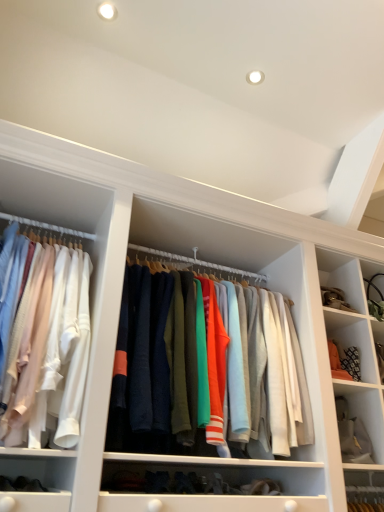
What do you see at coordinates (264, 368) in the screenshot? This screenshot has width=384, height=512. I see `knit sweater at center, placed as the second clothing when sorted from left to right` at bounding box center [264, 368].

What do you see at coordinates (49, 342) in the screenshot? I see `matte white shirts at left, acting as the first clothing starting from the left` at bounding box center [49, 342].

This screenshot has height=512, width=384. What do you see at coordinates (366, 412) in the screenshot?
I see `white fabric at lower right` at bounding box center [366, 412].

Where is `knit sweater at center, which is the 1th clothing from right to left`? knit sweater at center, which is the 1th clothing from right to left is located at coordinates (264, 368).

Is matte white shirts at left, acting as the first clothing starting from the left, to the right of white fabric at lower right from the viewer's perspective?

No.

Between matte white shirts at left, which is counted as the second clothing, starting from the right, and white fabric at lower right, which one is positioned behind?

white fabric at lower right.

From the image's perspective, which is above, matte white shirts at left, acting as the first clothing starting from the left, or white fabric at lower right?

matte white shirts at left, acting as the first clothing starting from the left, is shown above in the image.

Considering the relative sizes of knit sweater at center, placed as the second clothing when sorted from left to right, and white fabric at lower right in the image provided, is knit sweater at center, placed as the second clothing when sorted from left to right, wider than white fabric at lower right?

Yes, knit sweater at center, placed as the second clothing when sorted from left to right, is wider than white fabric at lower right.

Are knit sweater at center, which is the 1th clothing from right to left, and white fabric at lower right located far from each other?

That's not correct — knit sweater at center, which is the 1th clothing from right to left, is a little close to white fabric at lower right.

Based on the photo, what's the angular difference between knit sweater at center, which is the 1th clothing from right to left, and white fabric at lower right's facing directions?

They differ by 1.25 degrees in their facing directions.

Can you confirm if knit sweater at center, which is the 1th clothing from right to left, is taller than white fabric at lower right?

Correct, knit sweater at center, which is the 1th clothing from right to left, is much taller as white fabric at lower right.

Which of these two, knit sweater at center, which is the 1th clothing from right to left, or matte white shirts at left, acting as the first clothing starting from the left, is wider?

knit sweater at center, which is the 1th clothing from right to left, is wider.

Does knit sweater at center, which is the 1th clothing from right to left, have a smaller size compared to matte white shirts at left, which is counted as the second clothing, starting from the right?

No, knit sweater at center, which is the 1th clothing from right to left, is not smaller than matte white shirts at left, which is counted as the second clothing, starting from the right.

Is point (183, 329) closer or farther from the camera than point (75, 250)?

Point (183, 329) appears to be closer to the viewer than point (75, 250).

Considering the positions of objects knit sweater at center, which is the 1th clothing from right to left, and matte white shirts at left, acting as the first clothing starting from the left, in the image provided, who is more to the right, knit sweater at center, which is the 1th clothing from right to left, or matte white shirts at left, acting as the first clothing starting from the left,?

From the viewer's perspective, knit sweater at center, which is the 1th clothing from right to left, appears more on the right side.

Can you confirm if white fabric at lower right is positioned to the left of matte white shirts at left, which is counted as the second clothing, starting from the right?

No, white fabric at lower right is not to the left of matte white shirts at left, which is counted as the second clothing, starting from the right.

From a real-world perspective, is white fabric at lower right located beneath matte white shirts at left, acting as the first clothing starting from the left?

Yes.

Can you confirm if white fabric at lower right is taller than matte white shirts at left, acting as the first clothing starting from the left?

Incorrect, the height of white fabric at lower right is not larger of that of matte white shirts at left, acting as the first clothing starting from the left.

The width and height of the screenshot is (384, 512). I want to click on cabinet below the matte white shirts at left, acting as the first clothing starting from the left (from the image's perspective), so click(x=366, y=412).

Is point (89, 273) closer to viewer compared to point (295, 383)?

Yes, point (89, 273) is closer to viewer.

Is matte white shirts at left, which is counted as the second clothing, starting from the right, far from knit sweater at center, which is the 1th clothing from right to left?

No.

Does matte white shirts at left, acting as the first clothing starting from the left, have a greater width compared to knit sweater at center, placed as the second clothing when sorted from left to right?

No.

Can you see white fabric at lower right touching knit sweater at center, which is the 1th clothing from right to left?

No, white fabric at lower right is not making contact with knit sweater at center, which is the 1th clothing from right to left.

In the image, is white fabric at lower right positioned in front of or behind knit sweater at center, placed as the second clothing when sorted from left to right?

white fabric at lower right is positioned farther from the viewer than knit sweater at center, placed as the second clothing when sorted from left to right.

Does point (381, 404) appear closer or farther from the camera than point (267, 347)?

Point (381, 404) is farther from the camera than point (267, 347).

Is white fabric at lower right wider or thinner than knit sweater at center, which is the 1th clothing from right to left?

Considering their sizes, white fabric at lower right looks slimmer than knit sweater at center, which is the 1th clothing from right to left.

Find the location of a particular element. The image size is (384, 512). cabinet below the matte white shirts at left, which is counted as the second clothing, starting from the right (from a real-world perspective) is located at coordinates tap(366, 412).

Image resolution: width=384 pixels, height=512 pixels. I want to click on cabinet below the knit sweater at center, which is the 1th clothing from right to left (from the image's perspective), so click(x=366, y=412).

Estimate the real-world distances between objects in this image. Which object is further from matte white shirts at left, acting as the first clothing starting from the left, knit sweater at center, placed as the second clothing when sorted from left to right, or white fabric at lower right?

white fabric at lower right.

When comparing their distances from knit sweater at center, placed as the second clothing when sorted from left to right, does matte white shirts at left, which is counted as the second clothing, starting from the right, or white fabric at lower right seem further?

Answer: Based on the image, white fabric at lower right appears to be further to knit sweater at center, placed as the second clothing when sorted from left to right.

From the image, which object appears to be nearer to white fabric at lower right, matte white shirts at left, which is counted as the second clothing, starting from the right, or knit sweater at center, placed as the second clothing when sorted from left to right?

knit sweater at center, placed as the second clothing when sorted from left to right, lies closer to white fabric at lower right than the other object.

Based on their spatial positions, is white fabric at lower right or matte white shirts at left, which is counted as the second clothing, starting from the right, closer to knit sweater at center, which is the 1th clothing from right to left?

Based on the image, matte white shirts at left, which is counted as the second clothing, starting from the right, appears to be nearer to knit sweater at center, which is the 1th clothing from right to left.

Considering their positions, is knit sweater at center, placed as the second clothing when sorted from left to right, positioned closer to white fabric at lower right than matte white shirts at left, which is counted as the second clothing, starting from the right?

Based on the image, knit sweater at center, placed as the second clothing when sorted from left to right, appears to be nearer to white fabric at lower right.

Estimate the real-world distances between objects in this image. Which object is closer to matte white shirts at left, acting as the first clothing starting from the left, white fabric at lower right or knit sweater at center, which is the 1th clothing from right to left?

knit sweater at center, which is the 1th clothing from right to left, lies closer to matte white shirts at left, acting as the first clothing starting from the left, than the other object.

Image resolution: width=384 pixels, height=512 pixels. In order to click on clothing located between matte white shirts at left, acting as the first clothing starting from the left, and white fabric at lower right in the left-right direction in this screenshot , I will do `click(264, 368)`.